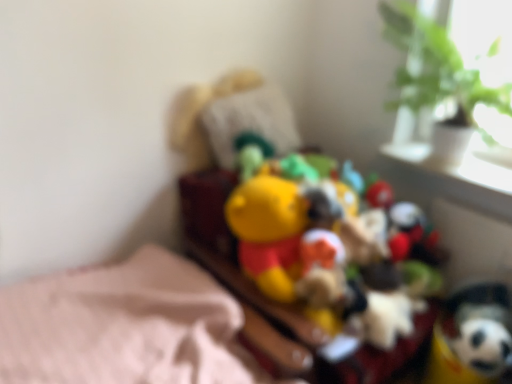
Question: Can you confirm if soft plush toy at lower right, placed as the first toy when sorted from right to left, is wider than yellow plush toy at center, arranged as the 2th toy when viewed from the right?

Choices:
 (A) yes
 (B) no

Answer: (B)

Question: Considering the relative sizes of soft plush toy at lower right, placed as the first toy when sorted from right to left, and yellow plush toy at center, arranged as the 2th toy when viewed from the right, in the image provided, is soft plush toy at lower right, placed as the first toy when sorted from right to left, thinner than yellow plush toy at center, arranged as the 2th toy when viewed from the right,?

Choices:
 (A) yes
 (B) no

Answer: (A)

Question: Is soft plush toy at lower right, the second toy when ordered from left to right, further to the viewer compared to yellow plush toy at center, which ranks as the 1th toy in left-to-right order?

Choices:
 (A) no
 (B) yes

Answer: (B)

Question: Is soft plush toy at lower right, the second toy when ordered from left to right, not near yellow plush toy at center, arranged as the 2th toy when viewed from the right?

Choices:
 (A) no
 (B) yes

Answer: (A)

Question: Is soft plush toy at lower right, placed as the first toy when sorted from right to left, at the right side of yellow plush toy at center, arranged as the 2th toy when viewed from the right?

Choices:
 (A) yes
 (B) no

Answer: (A)

Question: From a real-world perspective, is soft plush toy at lower right, placed as the first toy when sorted from right to left, on yellow plush toy at center, which ranks as the 1th toy in left-to-right order?

Choices:
 (A) yes
 (B) no

Answer: (B)

Question: From the image's perspective, is white glossy window sill at upper right over soft plush toy at lower right, the second toy when ordered from left to right?

Choices:
 (A) no
 (B) yes

Answer: (B)

Question: Is white glossy window sill at upper right in contact with soft plush toy at lower right, the second toy when ordered from left to right?

Choices:
 (A) no
 (B) yes

Answer: (A)

Question: Is white glossy window sill at upper right behind soft plush toy at lower right, the second toy when ordered from left to right?

Choices:
 (A) yes
 (B) no

Answer: (A)

Question: Would you say white glossy window sill at upper right is a long distance from soft plush toy at lower right, placed as the first toy when sorted from right to left?

Choices:
 (A) yes
 (B) no

Answer: (B)

Question: Is the position of white glossy window sill at upper right less distant than that of soft plush toy at lower right, the second toy when ordered from left to right?

Choices:
 (A) yes
 (B) no

Answer: (B)

Question: From the image's perspective, does white glossy window sill at upper right appear lower than soft plush toy at lower right, placed as the first toy when sorted from right to left?

Choices:
 (A) no
 (B) yes

Answer: (A)

Question: Is green leafy plant at upper right to the left of yellow plush toy at center, which ranks as the 1th toy in left-to-right order, from the viewer's perspective?

Choices:
 (A) yes
 (B) no

Answer: (B)